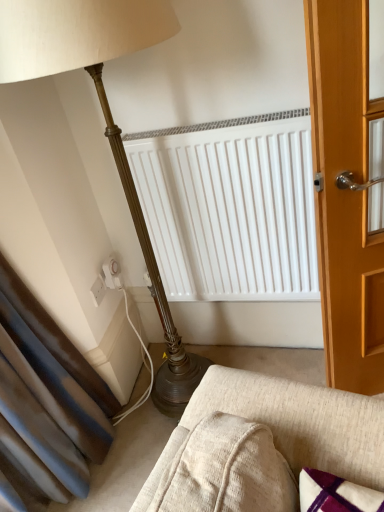
Question: Is textured beige fabric couch at lower center positioned before white plastic electric outlet at lower left, the 2th electric outlet when ordered from right to left?

Choices:
 (A) yes
 (B) no

Answer: (A)

Question: From a real-world perspective, is textured beige fabric couch at lower center located beneath white plastic electric outlet at lower left, marked as the first electric outlet in a left-to-right arrangement?

Choices:
 (A) no
 (B) yes

Answer: (B)

Question: From the image's perspective, is textured beige fabric couch at lower center located above white plastic electric outlet at lower left, the 2th electric outlet when ordered from right to left?

Choices:
 (A) no
 (B) yes

Answer: (A)

Question: Does textured beige fabric couch at lower center turn towards white plastic electric outlet at lower left, the 2th electric outlet when ordered from right to left?

Choices:
 (A) no
 (B) yes

Answer: (A)

Question: Is textured beige fabric couch at lower center shorter than white plastic electric outlet at lower left, marked as the first electric outlet in a left-to-right arrangement?

Choices:
 (A) yes
 (B) no

Answer: (A)

Question: Considering the positions of white plastic electric outlet at lower left, which is the 1th electric outlet from right to left, and textured beige fabric couch at lower center in the image, is white plastic electric outlet at lower left, which is the 1th electric outlet from right to left, bigger or smaller than textured beige fabric couch at lower center?

Choices:
 (A) big
 (B) small

Answer: (B)

Question: Choose the correct answer: Is white plastic electric outlet at lower left, the 2th electric outlet from the left, inside textured beige fabric couch at lower center or outside it?

Choices:
 (A) inside
 (B) outside

Answer: (B)

Question: Is white plastic electric outlet at lower left, which is the 1th electric outlet from right to left, in front of or behind textured beige fabric couch at lower center in the image?

Choices:
 (A) behind
 (B) front

Answer: (A)

Question: Considering the positions of white plastic electric outlet at lower left, the 2th electric outlet from the left, and textured beige fabric couch at lower center in the image, is white plastic electric outlet at lower left, the 2th electric outlet from the left, taller or shorter than textured beige fabric couch at lower center?

Choices:
 (A) short
 (B) tall

Answer: (B)

Question: Based on their positions, is white plastic electric outlet at lower left, marked as the first electric outlet in a left-to-right arrangement, located to the left or right of white plastic electric outlet at lower left, the 2th electric outlet from the left?

Choices:
 (A) left
 (B) right

Answer: (A)

Question: Is white plastic electric outlet at lower left, marked as the first electric outlet in a left-to-right arrangement, bigger or smaller than white plastic electric outlet at lower left, which is the 1th electric outlet from right to left?

Choices:
 (A) big
 (B) small

Answer: (B)

Question: Relative to white plastic electric outlet at lower left, which is the 1th electric outlet from right to left, is white plastic electric outlet at lower left, the 2th electric outlet when ordered from right to left, in front or behind?

Choices:
 (A) front
 (B) behind

Answer: (A)

Question: In terms of width, does white plastic electric outlet at lower left, the 2th electric outlet when ordered from right to left, look wider or thinner when compared to white plastic electric outlet at lower left, the 2th electric outlet from the left?

Choices:
 (A) wide
 (B) thin

Answer: (B)

Question: Considering the positions of point (203, 414) and point (97, 295), is point (203, 414) closer or farther from the camera than point (97, 295)?

Choices:
 (A) closer
 (B) farther

Answer: (A)

Question: In the image, is textured beige fabric couch at lower center on the left side or the right side of white plastic electric outlet at lower left, the 2th electric outlet when ordered from right to left?

Choices:
 (A) left
 (B) right

Answer: (B)